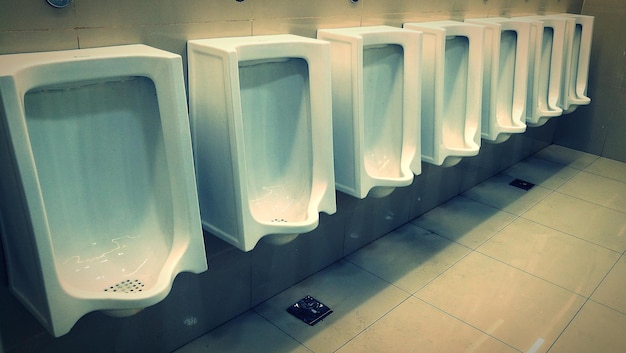
Find the location of a particular element. urinals is located at coordinates (72, 168), (243, 157), (377, 128), (467, 106), (501, 92), (546, 92), (580, 72).